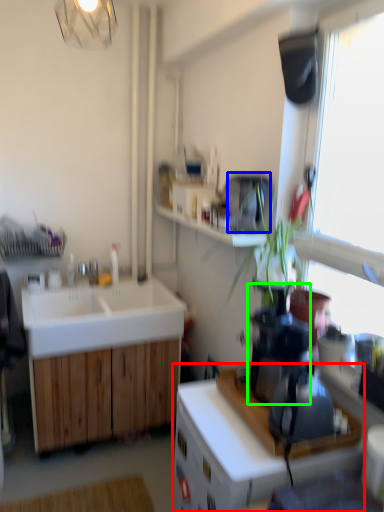
Question: Which object is the closest to the cabinetry (highlighted by a red box)? Choose among these: appliance (highlighted by a blue box) or coffee machine (highlighted by a green box).

Choices:
 (A) appliance
 (B) coffee machine

Answer: (B)